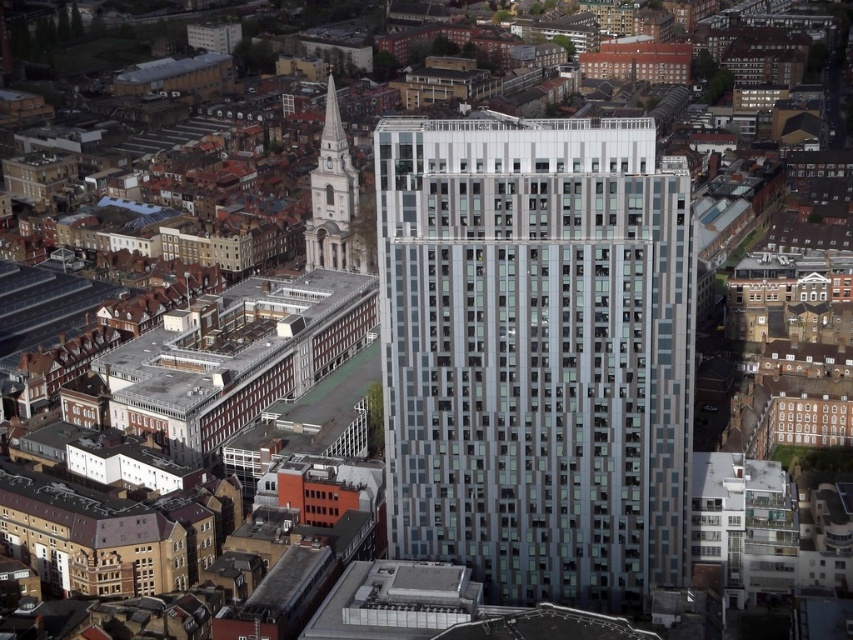
Looking at this image, is silver glass building at center wider than white stone tower at upper left?

Indeed, silver glass building at center has a greater width compared to white stone tower at upper left.

Can you confirm if silver glass building at center is positioned below white stone tower at upper left?

Indeed, silver glass building at center is positioned under white stone tower at upper left.

Identify the location of silver glass building at center. (537, 353).

This screenshot has width=853, height=640. I want to click on silver glass building at center, so (537, 353).